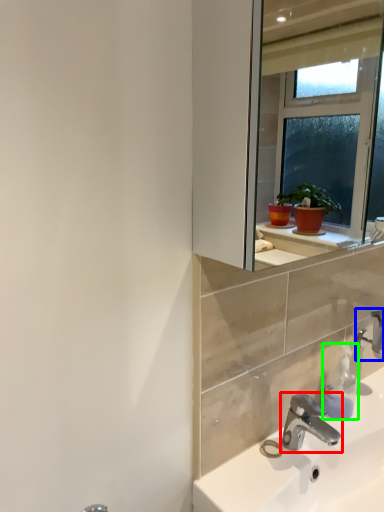
Question: Based on their relative distances, which object is nearer to tap (highlighted by a red box)? Choose from tap (highlighted by a blue box) and soap dispenser (highlighted by a green box).

Choices:
 (A) tap
 (B) soap dispenser

Answer: (B)